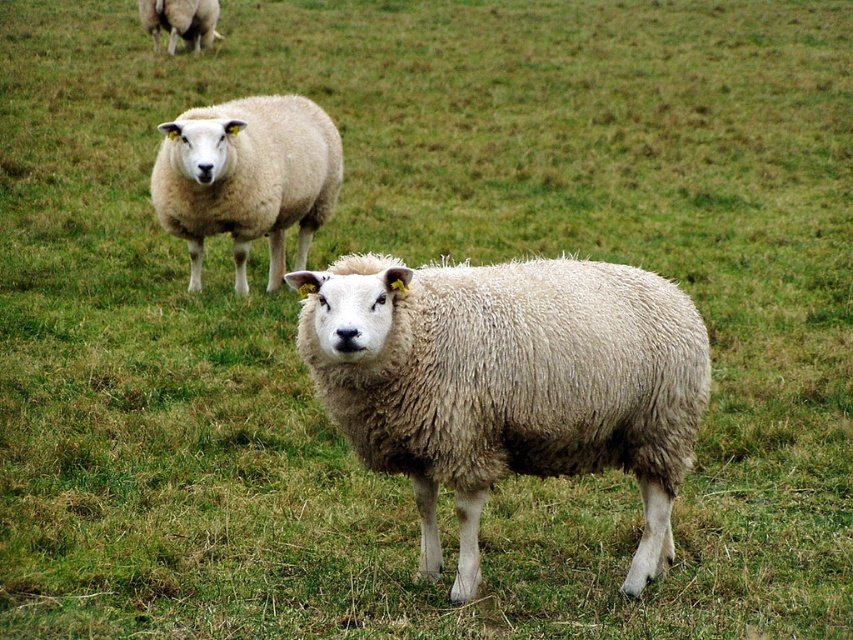
Question: Considering the real-world distances, which object is closest to the white woolen sheep at upper left?

Choices:
 (A) fuzzy white sheep at upper left
 (B) fuzzy woolen sheep at center

Answer: (B)

Question: Which object is positioned closest to the fuzzy white sheep at upper left?

Choices:
 (A) white woolen sheep at upper left
 (B) fuzzy woolen sheep at center

Answer: (A)

Question: Among these points, which one is nearest to the camera?

Choices:
 (A) (642, 563)
 (B) (329, 161)

Answer: (A)

Question: Is fuzzy woolen sheep at center below fuzzy white sheep at upper left?

Choices:
 (A) no
 (B) yes

Answer: (B)

Question: Considering the relative positions of fuzzy woolen sheep at center and white woolen sheep at upper left in the image provided, where is fuzzy woolen sheep at center located with respect to white woolen sheep at upper left?

Choices:
 (A) right
 (B) left

Answer: (A)

Question: Does fuzzy woolen sheep at center have a larger size compared to fuzzy white sheep at upper left?

Choices:
 (A) yes
 (B) no

Answer: (B)